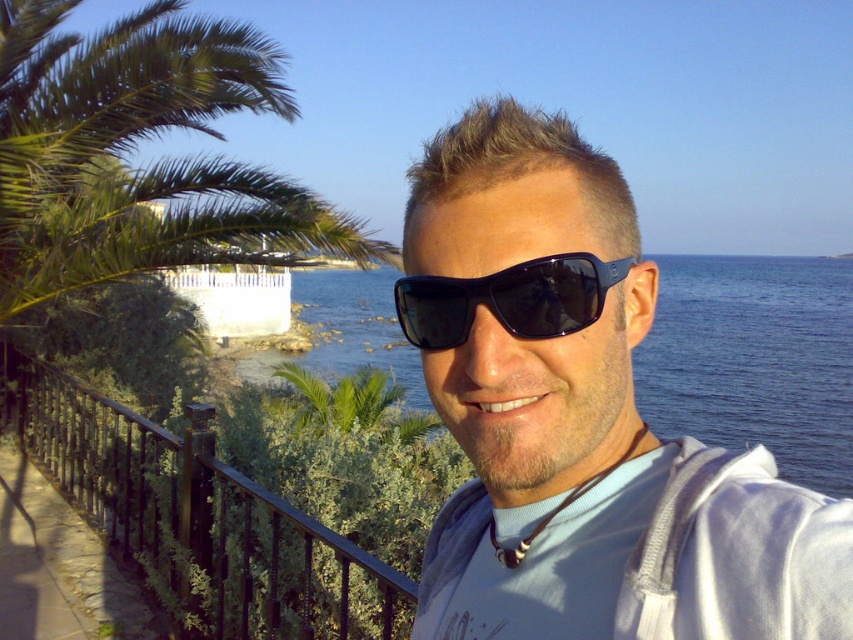
Who is shorter, black wrought iron railing at lower left or black plastic sunglasses at center?

With less height is black plastic sunglasses at center.

Between black wrought iron railing at lower left and black plastic sunglasses at center, which one has more height?

black wrought iron railing at lower left

Is point (136, 486) positioned before point (567, 314)?

No, (136, 486) is further to viewer.

Where is `black wrought iron railing at lower left`? This screenshot has width=853, height=640. black wrought iron railing at lower left is located at coordinates (196, 518).

Is matte black sunglasses at center above black plastic sunglasses at center?

Incorrect, matte black sunglasses at center is not positioned above black plastic sunglasses at center.

Is point (764, 480) more distant than point (427, 340)?

No, (764, 480) is in front of (427, 340).

You are a GUI agent. You are given a task and a screenshot of the screen. Output one action in this format:
    pyautogui.click(x=<x>, y=<y>)
    Task: Click on the matte black sunglasses at center
    Image resolution: width=853 pixels, height=640 pixels.
    Given the screenshot: What is the action you would take?
    pyautogui.click(x=582, y=416)

Can you confirm if matte black sunglasses at center is positioned to the left of black wrought iron railing at lower left?

No, matte black sunglasses at center is not to the left of black wrought iron railing at lower left.

Is matte black sunglasses at center above black wrought iron railing at lower left?

Yes.

Who is more distant from viewer, (x=750, y=618) or (x=260, y=621)?

Point (x=260, y=621)

Locate an element on the screen. matte black sunglasses at center is located at coordinates (582, 416).